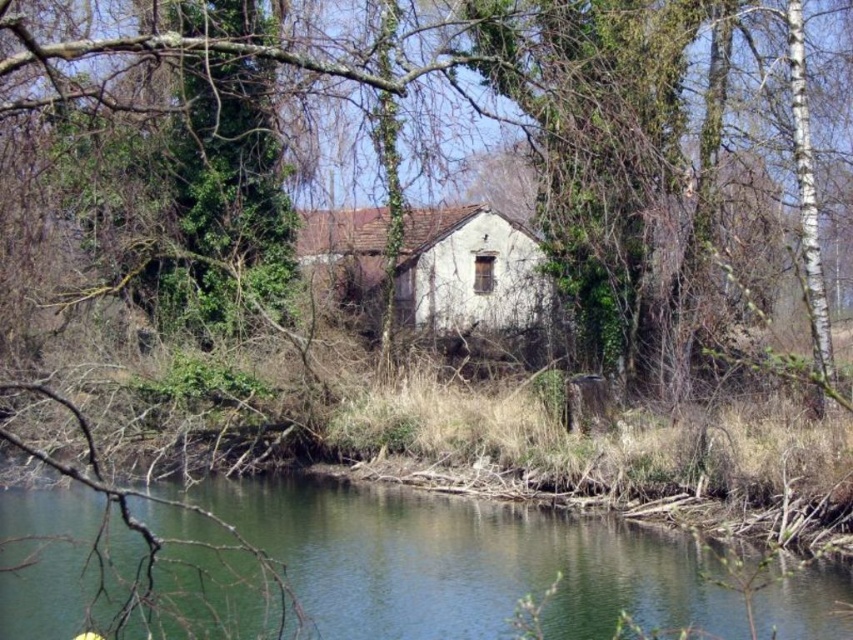
Is green water at lower center to the left of white rough wooden hut at center from the viewer's perspective?

Yes, green water at lower center is to the left of white rough wooden hut at center.

Is point (236, 481) behind point (416, 275)?

No, it is not.

The image size is (853, 640). What are the coordinates of `green water at lower center` in the screenshot? It's located at (466, 563).

Is white rough wooden hut at center to the right of green ivy-covered tree at center from the viewer's perspective?

Indeed, white rough wooden hut at center is positioned on the right side of green ivy-covered tree at center.

Who is more distant from viewer, (460, 262) or (809, 285)?

The point (460, 262) is behind.

Between point (523, 234) and point (827, 353), which one is positioned behind?

Positioned behind is point (523, 234).

Locate an element on the screen. The height and width of the screenshot is (640, 853). white rough wooden hut at center is located at coordinates (468, 272).

Who is positioned more to the left, green water at lower center or green ivy-covered tree at center?

green water at lower center

Where is `green water at lower center`? This screenshot has height=640, width=853. green water at lower center is located at coordinates (466, 563).

This screenshot has height=640, width=853. Identify the location of green water at lower center. (466, 563).